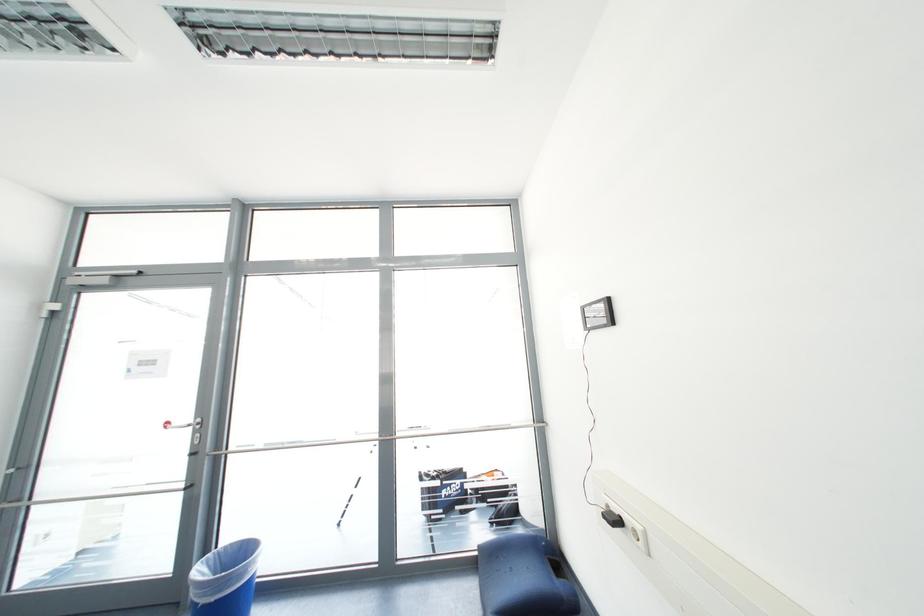
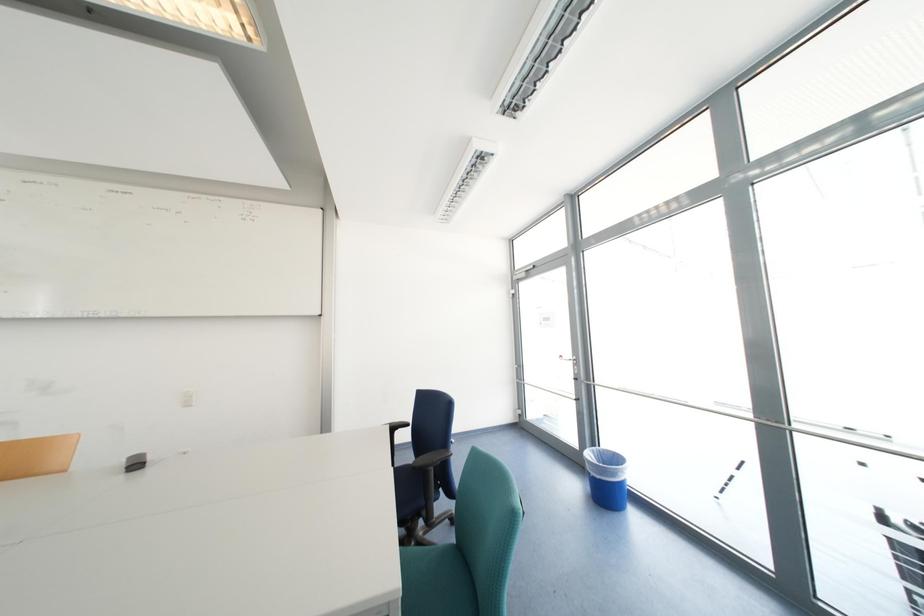
Question: How did the camera likely rotate?

Choices:
 (A) Left
 (B) Right
 (C) Up
 (D) Down

Answer: (A)